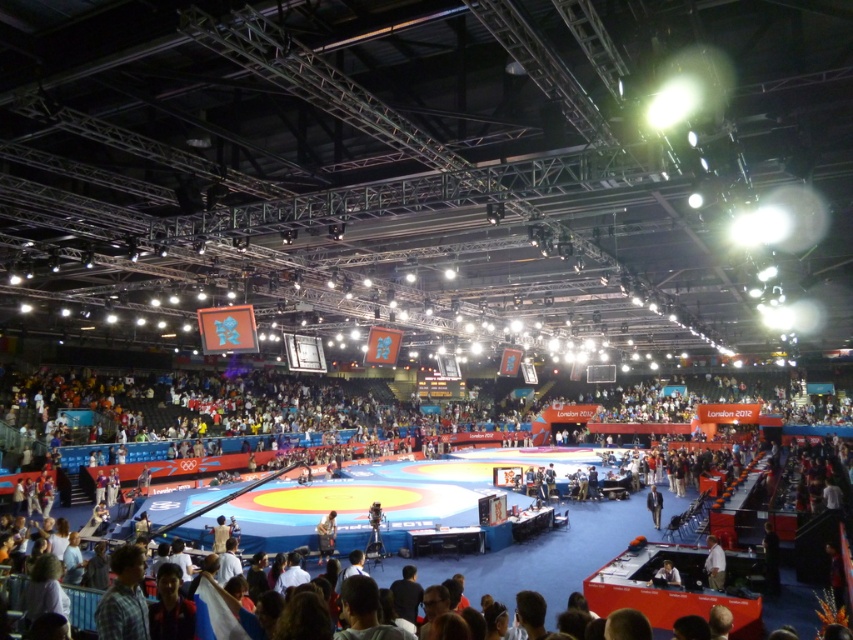
Question: Based on their relative distances, which object is farther from the blue fabric mat at center?

Choices:
 (A) light brown leather jacket at lower center
 (B) white shirt at lower right
 (C) blue fabric jacket at center

Answer: (A)

Question: Is blue fabric mat at center positioned behind white shirt at lower right?

Choices:
 (A) no
 (B) yes

Answer: (A)

Question: Estimate the real-world distances between objects in this image. Which object is closer to the blue fabric jacket at center?

Choices:
 (A) white shirt at lower right
 (B) blue fabric mat at center
 (C) light brown leather jacket at lower center

Answer: (A)

Question: Is white shirt at lower right above light brown leather jacket at lower center?

Choices:
 (A) no
 (B) yes

Answer: (A)

Question: Which of the following is the closest to the observer?

Choices:
 (A) blue fabric mat at center
 (B) light brown leather jacket at lower center
 (C) white shirt at lower right

Answer: (A)

Question: Can you confirm if white shirt at lower right is thinner than blue fabric jacket at center?

Choices:
 (A) no
 (B) yes

Answer: (B)